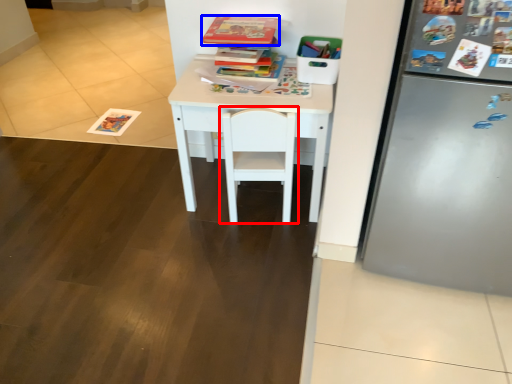
Question: Which of the following is the farthest to the observer, chair (highlighted by a red box) or book (highlighted by a blue box)?

Choices:
 (A) chair
 (B) book

Answer: (B)